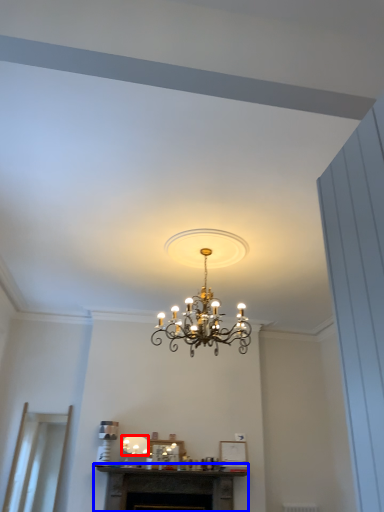
Question: Among these objects, which one is nearest to the camera, lamp (highlighted by a red box) or fireplace (highlighted by a blue box)?

Choices:
 (A) lamp
 (B) fireplace

Answer: (B)